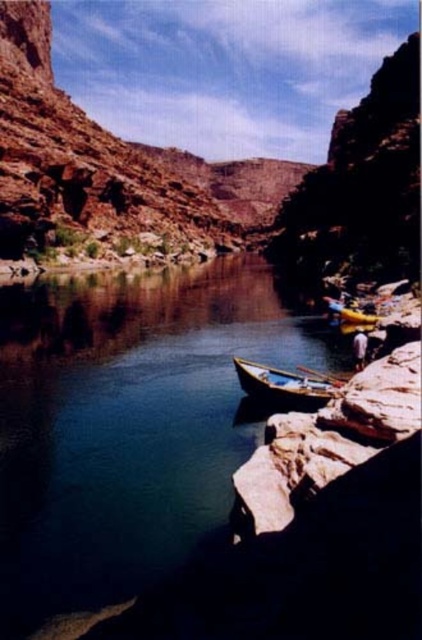
Question: Can you confirm if clear blue water at lower left is smaller than wooden paddle at lower center?

Choices:
 (A) no
 (B) yes

Answer: (A)

Question: Can you confirm if clear blue water at lower left is wider than wooden boat at center?

Choices:
 (A) no
 (B) yes

Answer: (B)

Question: Among these points, which one is nearest to the camera?

Choices:
 (A) (178, 538)
 (B) (313, 369)

Answer: (A)

Question: Does wooden boat at center have a larger size compared to wooden paddle at lower center?

Choices:
 (A) no
 (B) yes

Answer: (B)

Question: Which point appears closest to the camera in this image?

Choices:
 (A) (340, 381)
 (B) (124, 314)
 (C) (267, 392)

Answer: (C)

Question: Which point is farther from the camera taking this photo?

Choices:
 (A) (240, 378)
 (B) (154, 308)
 (C) (314, 372)

Answer: (B)